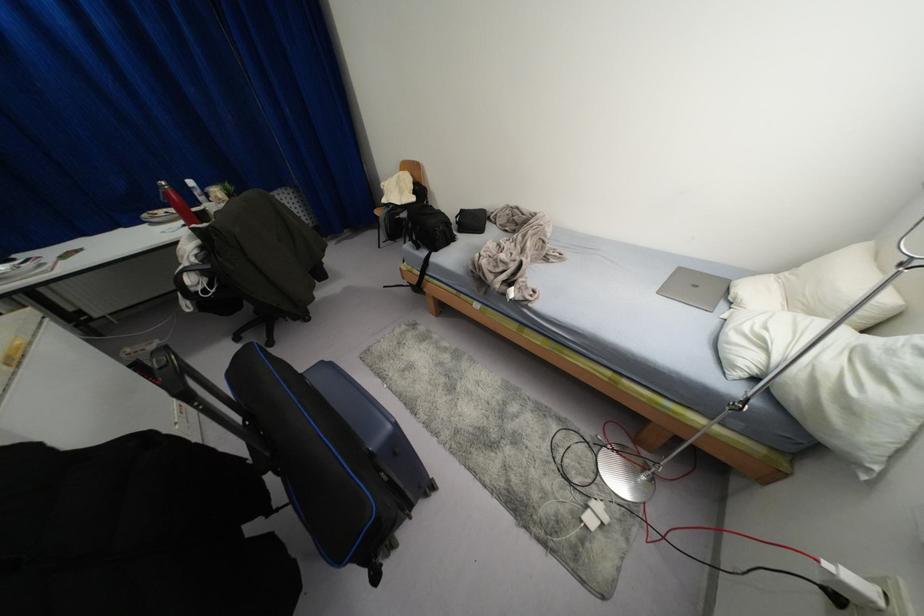
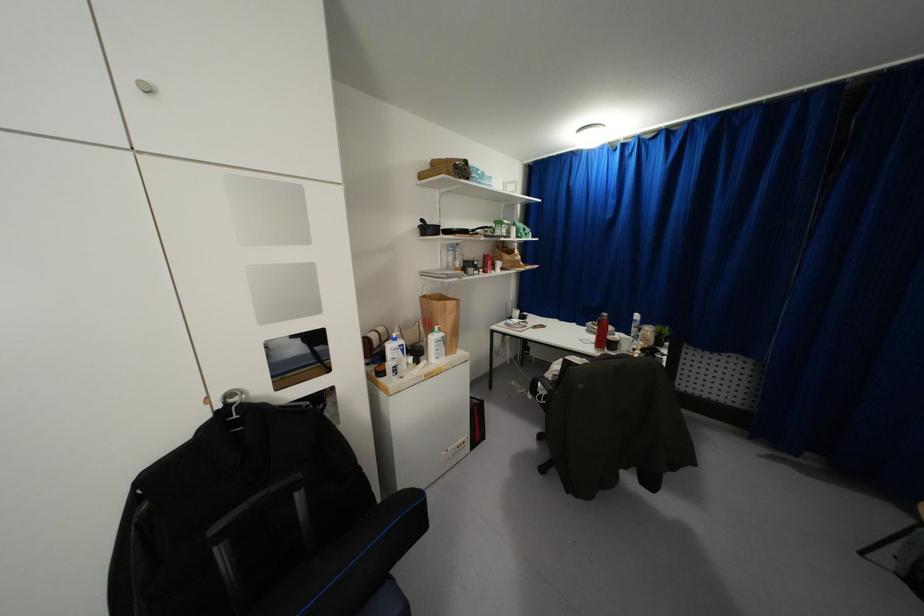
In the second image, find the point that corresponds to point (196, 256) in the first image.

(553, 376)